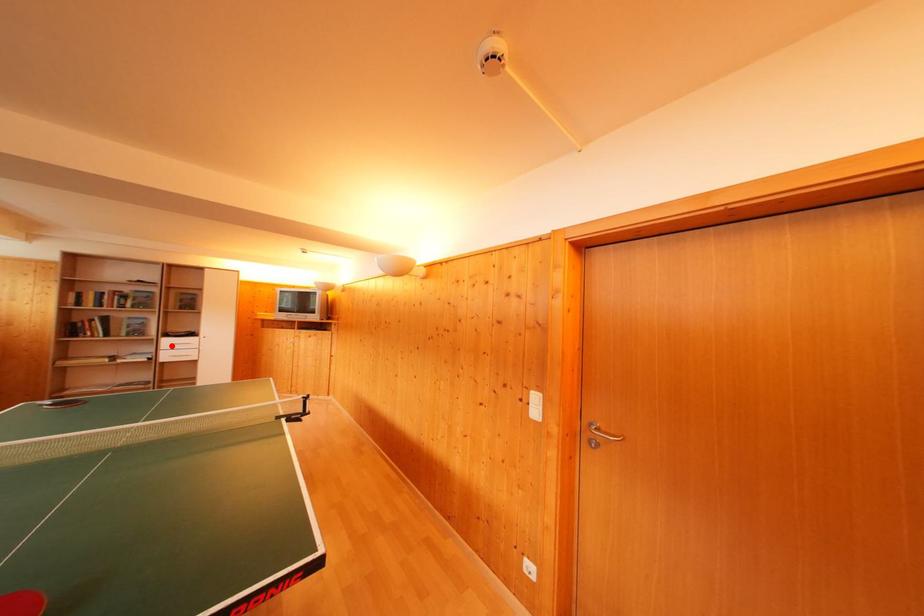
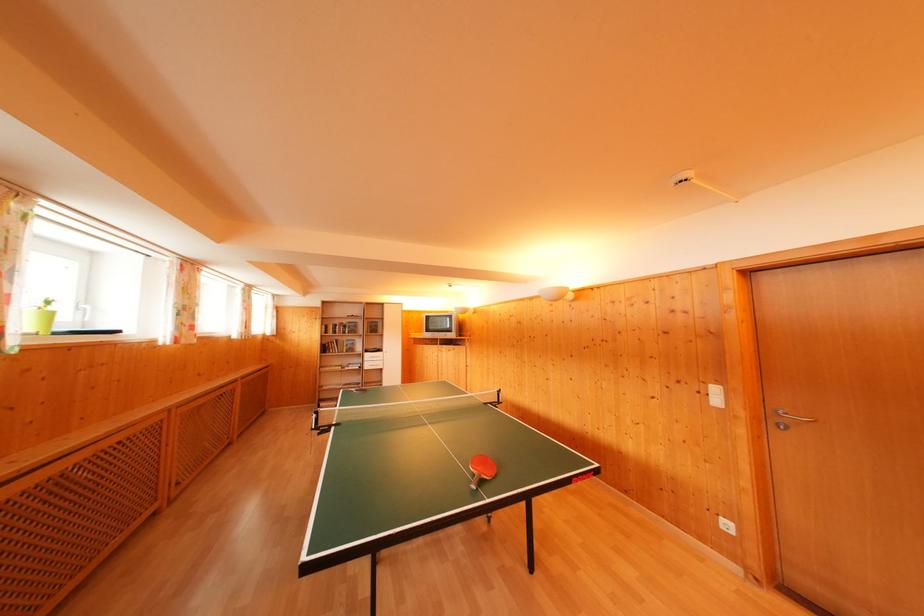
Question: I am providing you with two images of the same scene from different viewpoints. In image1, a red point is highlighted. Considering the same 3D point in image2, which of the following is correct?

Choices:
 (A) It is closer
 (B) It is farther

Answer: (B)